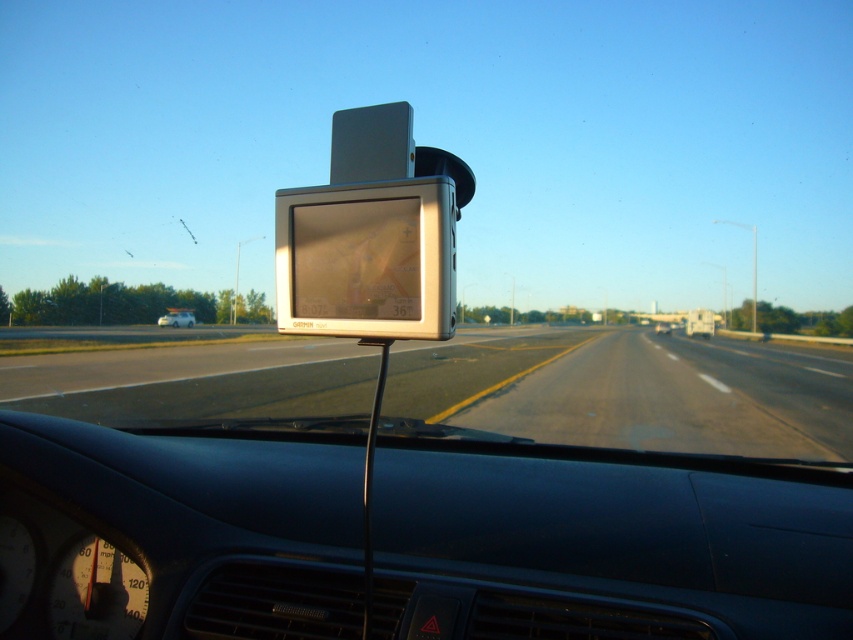
Question: Where is smooth asphalt highway at center located in relation to white matte van at lower left in the image?

Choices:
 (A) above
 (B) below

Answer: (B)

Question: Among these points, which one is nearest to the camera?

Choices:
 (A) (740, 364)
 (B) (177, 312)

Answer: (A)

Question: Which point is closer to the camera taking this photo?

Choices:
 (A) (231, 412)
 (B) (193, 310)

Answer: (A)

Question: Does smooth asphalt highway at center appear under white matte van at lower left?

Choices:
 (A) yes
 (B) no

Answer: (A)

Question: Is smooth asphalt highway at center wider than white matte van at lower left?

Choices:
 (A) yes
 (B) no

Answer: (A)